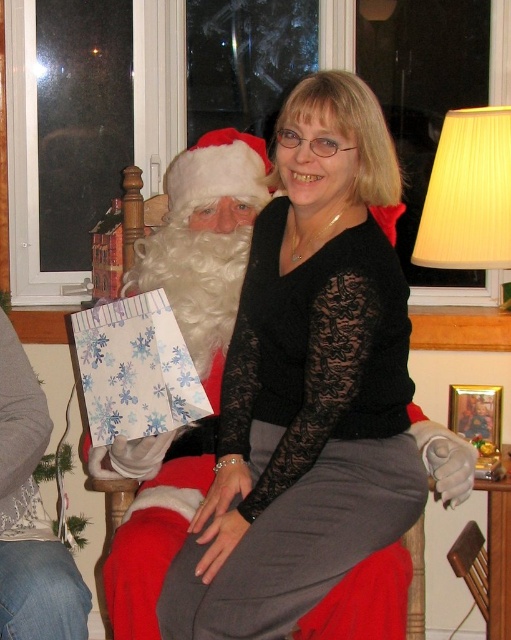
Does black lace sweater at center lie behind white fluffy beard at left?

No, black lace sweater at center is in front of white fluffy beard at left.

Is black lace sweater at center thinner than white fluffy beard at left?

Incorrect, black lace sweater at center's width is not less than white fluffy beard at left's.

Find the location of a particular element. Image resolution: width=511 pixels, height=640 pixels. black lace sweater at center is located at coordinates (308, 385).

The image size is (511, 640). Find the location of `black lace sweater at center`. black lace sweater at center is located at coordinates (308, 385).